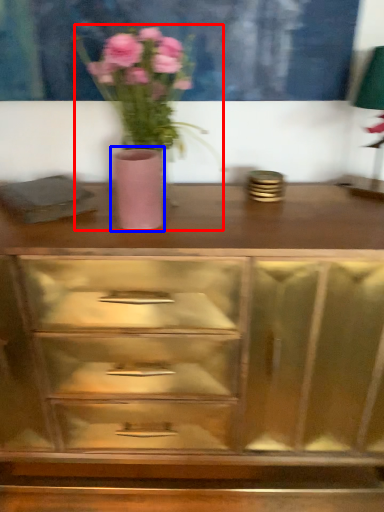
Question: Which object is closer to the camera taking this photo, floral arrangement (highlighted by a red box) or vase (highlighted by a blue box)?

Choices:
 (A) floral arrangement
 (B) vase

Answer: (A)